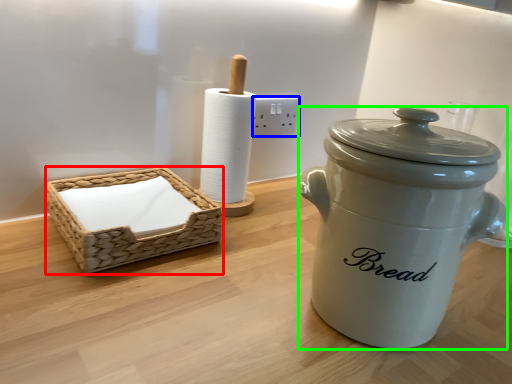
Question: Which object is the closest to the basket (highlighted by a red box)? Choose among these: electric outlet (highlighted by a blue box) or crock pot (highlighted by a green box).

Choices:
 (A) electric outlet
 (B) crock pot

Answer: (B)